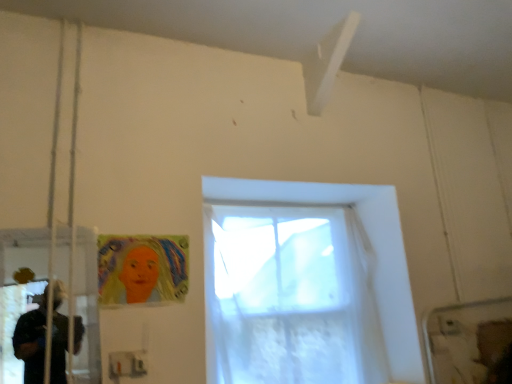
Image resolution: width=512 pixels, height=384 pixels. What do you see at coordinates (87, 305) in the screenshot?
I see `transparent plastic screen door at left` at bounding box center [87, 305].

I want to click on translucent white curtain at center, so click(371, 243).

Looking at this image, considering the relative sizes of pastel crayon drawing of a woman at lower left and translucent white curtain at center in the image provided, is pastel crayon drawing of a woman at lower left shorter than translucent white curtain at center?

Yes.

Is translucent white curtain at center at the back of pastel crayon drawing of a woman at lower left?

No, pastel crayon drawing of a woman at lower left is not facing away from translucent white curtain at center.

Between point (104, 241) and point (408, 381), which one is positioned behind?

Point (408, 381)

From a real-world perspective, is pastel crayon drawing of a woman at lower left located beneath translucent white curtain at center?

Actually, pastel crayon drawing of a woman at lower left is physically above translucent white curtain at center in the real world.

Looking at this image, which of these two, transparent plastic screen door at left or pastel crayon drawing of a woman at lower left, is bigger?

With larger size is transparent plastic screen door at left.

Is transparent plastic screen door at left far from pastel crayon drawing of a woman at lower left?

transparent plastic screen door at left is near pastel crayon drawing of a woman at lower left, not far away.

From a real-world perspective, is transparent plastic screen door at left physically located above or below pastel crayon drawing of a woman at lower left?

transparent plastic screen door at left is situated lower than pastel crayon drawing of a woman at lower left in the real world.

Considering the relative positions of transparent plastic screen door at left and pastel crayon drawing of a woman at lower left in the image provided, is transparent plastic screen door at left to the right of pastel crayon drawing of a woman at lower left from the viewer's perspective?

No, transparent plastic screen door at left is not to the right of pastel crayon drawing of a woman at lower left.

Based on their sizes in the image, would you say transparent plastic screen door at left is bigger or smaller than translucent white curtain at center?

In the image, transparent plastic screen door at left appears to be smaller than translucent white curtain at center.

Between transparent plastic screen door at left and translucent white curtain at center, which one has more height?

translucent white curtain at center.

Is transparent plastic screen door at left located outside translucent white curtain at center?

That's correct, transparent plastic screen door at left is outside of translucent white curtain at center.

Locate an element on the screen. The image size is (512, 384). screen door on the left of translucent white curtain at center is located at coordinates (87, 305).

Is translucent white curtain at center not inside transparent plastic screen door at left?

Yes, translucent white curtain at center is located beyond the bounds of transparent plastic screen door at left.

Consider the image. Does translucent white curtain at center touch transparent plastic screen door at left?

No, translucent white curtain at center is not beside transparent plastic screen door at left.

Is translucent white curtain at center behind transparent plastic screen door at left?

Yes, it is behind transparent plastic screen door at left.

Is translucent white curtain at center positioned beyond the bounds of pastel crayon drawing of a woman at lower left?

translucent white curtain at center lies outside pastel crayon drawing of a woman at lower left's area.

In the image, is translucent white curtain at center on the left side or the right side of pastel crayon drawing of a woman at lower left?

Based on their positions, translucent white curtain at center is located to the right of pastel crayon drawing of a woman at lower left.

Is translucent white curtain at center smaller than pastel crayon drawing of a woman at lower left?

Actually, translucent white curtain at center might be larger than pastel crayon drawing of a woman at lower left.

Is pastel crayon drawing of a woman at lower left far from transparent plastic screen door at left?

No, pastel crayon drawing of a woman at lower left is in close proximity to transparent plastic screen door at left.

Is point (112, 268) closer to camera compared to point (47, 240)?

No, (112, 268) is behind (47, 240).

Is pastel crayon drawing of a woman at lower left completely or partially outside of transparent plastic screen door at left?

Yes, pastel crayon drawing of a woman at lower left is located beyond the bounds of transparent plastic screen door at left.

Locate an element on the screen. window below the pastel crayon drawing of a woman at lower left (from the image's perspective) is located at coordinates (371, 243).

The width and height of the screenshot is (512, 384). Find the location of `woman that is above the transparent plastic screen door at left (from a real-world perspective)`. woman that is above the transparent plastic screen door at left (from a real-world perspective) is located at coordinates (142, 269).

Considering their positions, is pastel crayon drawing of a woman at lower left positioned closer to translucent white curtain at center than transparent plastic screen door at left?

The object closer to translucent white curtain at center is pastel crayon drawing of a woman at lower left.

Which object lies further to the anchor point transparent plastic screen door at left, translucent white curtain at center or pastel crayon drawing of a woman at lower left?

translucent white curtain at center.

Looking at the image, which one is located closer to pastel crayon drawing of a woman at lower left, transparent plastic screen door at left or translucent white curtain at center?

The object closer to pastel crayon drawing of a woman at lower left is transparent plastic screen door at left.

When comparing their distances from translucent white curtain at center, does transparent plastic screen door at left or pastel crayon drawing of a woman at lower left seem further?

transparent plastic screen door at left is positioned further to the anchor translucent white curtain at center.

From the image, which object appears to be nearer to transparent plastic screen door at left, pastel crayon drawing of a woman at lower left or translucent white curtain at center?

pastel crayon drawing of a woman at lower left is positioned closer to the anchor transparent plastic screen door at left.

From the image, which object appears to be nearer to pastel crayon drawing of a woman at lower left, translucent white curtain at center or transparent plastic screen door at left?

transparent plastic screen door at left is positioned closer to the anchor pastel crayon drawing of a woman at lower left.

Identify the location of woman between transparent plastic screen door at left and translucent white curtain at center. Image resolution: width=512 pixels, height=384 pixels. (142, 269).